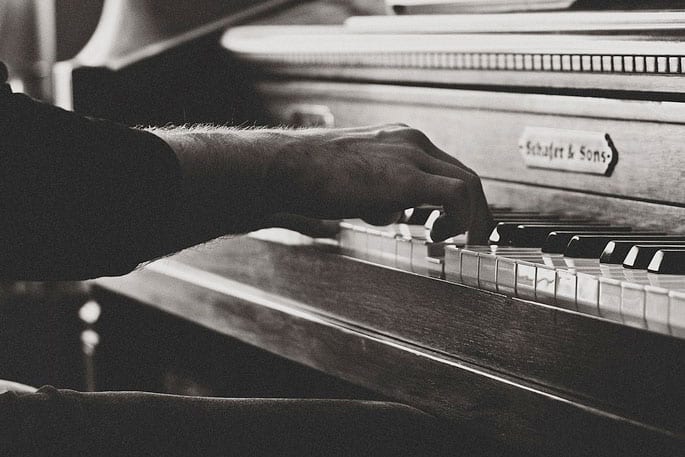
The width and height of the screenshot is (685, 457). In order to click on glare on white keys in this screenshot , I will do `click(525, 271)`, `click(544, 261)`, `click(566, 263)`, `click(606, 271)`, `click(627, 281)`, `click(405, 228)`.